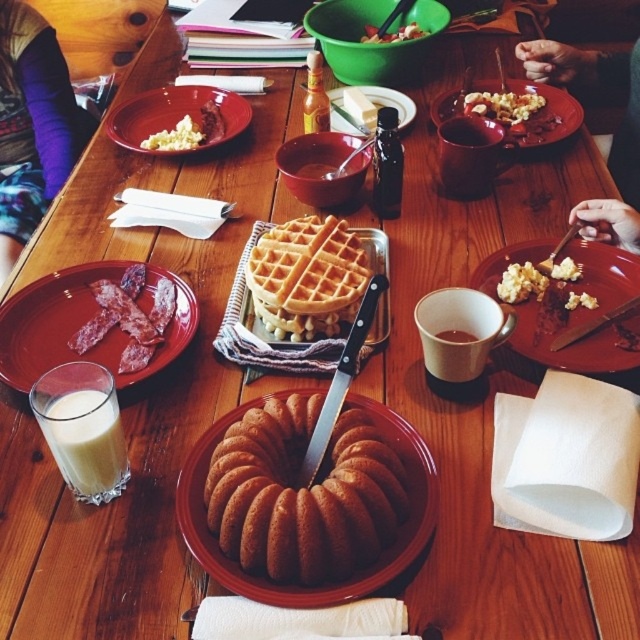
From the picture: Which of these two, brown glazed bundt cake at center or white fluffy popcorn at center, stands taller?

With more height is brown glazed bundt cake at center.

Between point (376, 550) and point (500, 282), which one is positioned behind?

The point (500, 282) is behind.

Between point (250, 593) and point (515, 298), which one is positioned in front?

Positioned in front is point (250, 593).

At what (x,y) coordinates should I click in order to perform the action: click on brown glazed bundt cake at center. Please return your answer as a coordinate pair (x, y). Image resolution: width=640 pixels, height=640 pixels. Looking at the image, I should click on (321, 512).

Is point (296, 292) positioned in front of point (506, 112)?

Yes.

Is golden brown waffle at center thinner than crumbly yellow cake at upper right?

No.

What do you see at coordinates (308, 266) in the screenshot? I see `golden brown waffle at center` at bounding box center [308, 266].

Identify the location of golden brown waffle at center. The image size is (640, 640). (308, 266).

Does purple fabric at upper left have a larger size compared to matte brown plate at center?

Correct, purple fabric at upper left is larger in size than matte brown plate at center.

From the picture: Can you confirm if purple fabric at upper left is thinner than matte brown plate at center?

No.

Is point (44, 80) closer to viewer compared to point (538, 252)?

No, (44, 80) is further to viewer.

At what (x,y) coordinates should I click in order to perform the action: click on purple fabric at upper left. Please return your answer as a coordinate pair (x, y). Looking at the image, I should click on (32, 125).